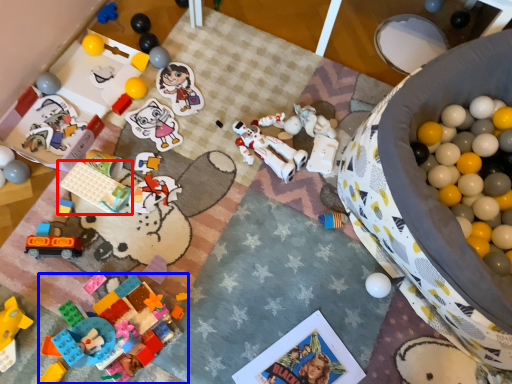
Question: Which of the following is the farthest to the observer, toy (highlighted by a red box) or toy (highlighted by a blue box)?

Choices:
 (A) toy
 (B) toy

Answer: (A)